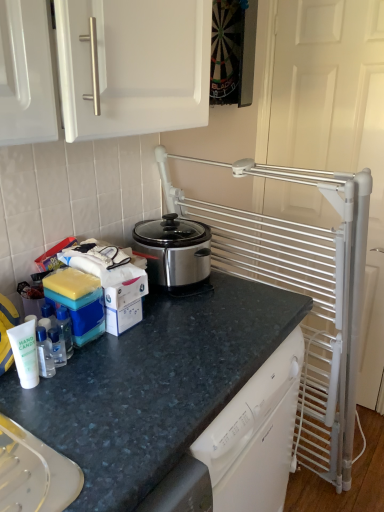
Identify the location of space that is in front of white matte hand sanitizer at lower left, the 1th bottle viewed from the front. This screenshot has height=512, width=384. (30, 431).